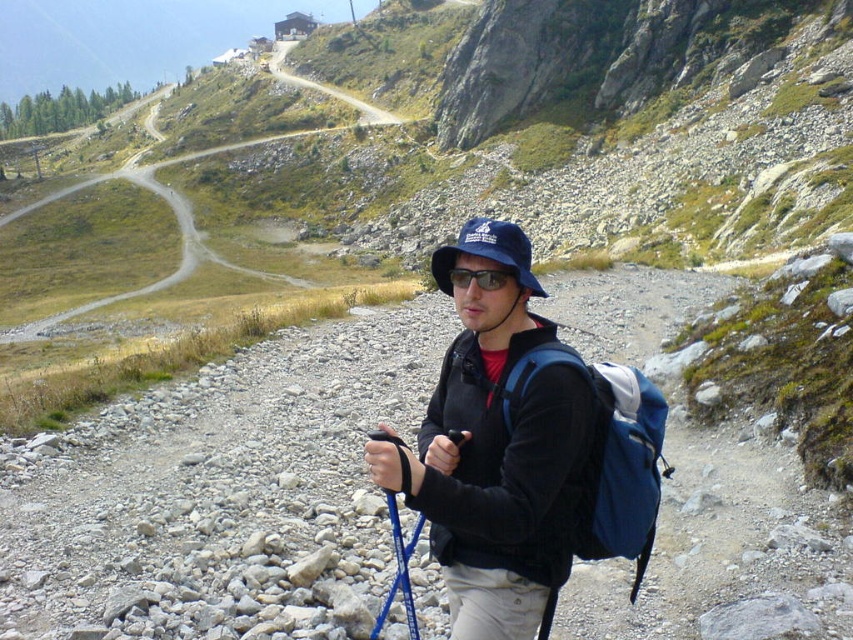
You are a hiker trying to locate your jacket and backpack. You see the matte black jacket at center and the blue fabric backpack at center. Which item is positioned to the left when facing the scene?

The matte black jacket at center is to the left of the blue fabric backpack at center.

You are a hiker planning to walk along the trail in the image. There are two points marked on the trail. The first point is at coordinates point (468, 225) and the second point is at point (454, 288). Which point is closer to you as you stand at the starting point of the trail?

Point (468, 225) is closer to you because it is further to the viewer than point (454, 288), meaning it lies ahead on the trail closer to your current position.

You are a drone operator trying to capture aerial footage of the mountain trail. You have two points marked on your map, point (451, 513) and point (651, 538). Which point should you prioritize for a closer shot if you want to show the hiker in detail?

Point (451, 513) is closer to the camera than point (651, 538), so you should prioritize point (451, 513) for a closer shot to show the hiker in detail.